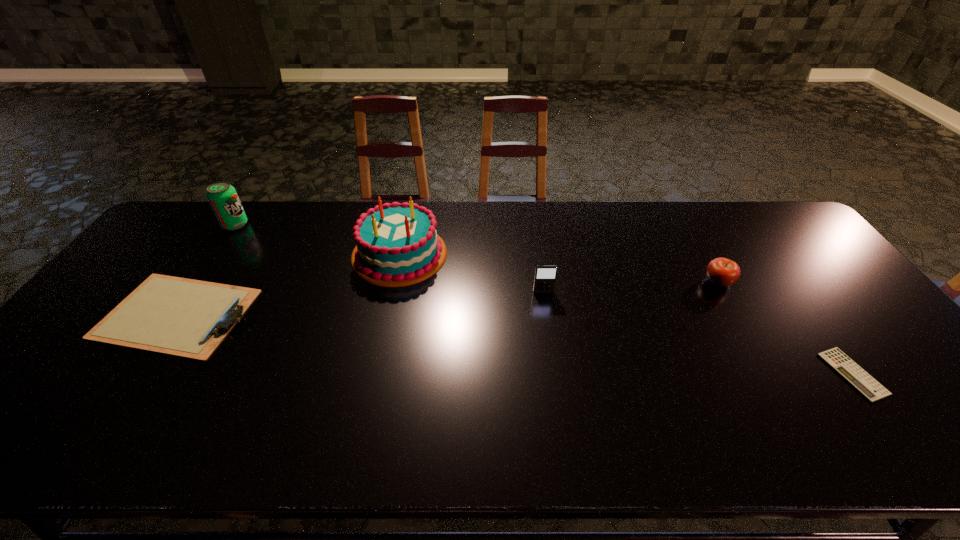
Identify the location of the fourth object from right to left. The width and height of the screenshot is (960, 540). (397, 245).

Where is `the tallest object`? the tallest object is located at coordinates (397, 245).

This screenshot has width=960, height=540. Find the location of `the second tallest object`. the second tallest object is located at coordinates (222, 196).

Where is `iPod`? iPod is located at coordinates (545, 276).

Locate an element on the screen. the fourth shortest object is located at coordinates (545, 276).

Locate an element on the screen. Image resolution: width=960 pixels, height=540 pixels. the third shortest object is located at coordinates (722, 272).

You are a GUI agent. You are given a task and a screenshot of the screen. Output one action in this format:
    pyautogui.click(x=<x>, y=<y>)
    Task: Click on the apple
    The image size is (960, 540).
    Given the screenshot: What is the action you would take?
    pyautogui.click(x=722, y=272)

Where is `the second shortest object`? This screenshot has width=960, height=540. the second shortest object is located at coordinates (188, 318).

Find the location of a particular element. Image resolution: width=960 pixels, height=540 pixels. calculator is located at coordinates (865, 384).

Where is `the shortest object`? the shortest object is located at coordinates (865, 384).